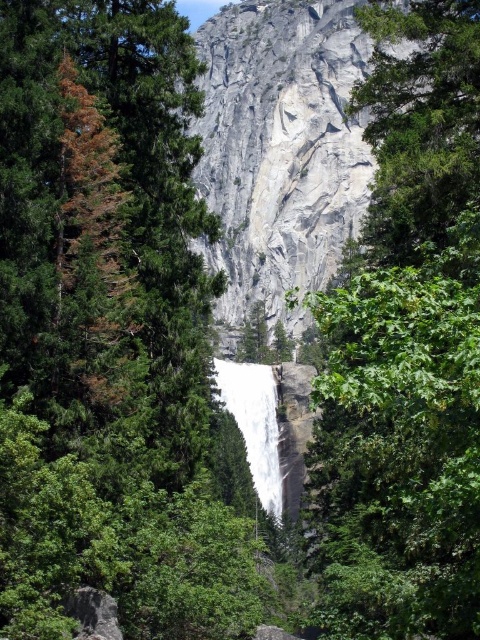
Does point (312, 168) come farther from viewer compared to point (257, 396)?

Yes.

Can you confirm if gray/rough rock at center is smaller than white smooth waterfall at center?

No, gray/rough rock at center is not smaller than white smooth waterfall at center.

You are a GUI agent. You are given a task and a screenshot of the screen. Output one action in this format:
    pyautogui.click(x=<x>, y=<y>)
    Task: Click on the gray/rough rock at center
    The image size is (480, 640).
    Given the screenshot: What is the action you would take?
    pyautogui.click(x=309, y=140)

Looking at this image, is the position of green matte tree at center more distant than that of gray/rough rock at center?

No, it is not.

Can you confirm if green matte tree at center is wider than gray/rough rock at center?

No.

Is point (202, 496) closer to camera compared to point (252, 284)?

Yes, point (202, 496) is closer to viewer.

The height and width of the screenshot is (640, 480). In order to click on green matte tree at center in this screenshot , I will do `click(109, 332)`.

How far apart are green leafy tree at center and gray/rough rock at center?

green leafy tree at center is 19.11 meters from gray/rough rock at center.

Does green leafy tree at center come behind gray/rough rock at center?

No, it is in front of gray/rough rock at center.

Describe the element at coordinates (405, 349) in the screenshot. I see `green leafy tree at center` at that location.

Identify the location of green leafy tree at center. The height and width of the screenshot is (640, 480). (405, 349).